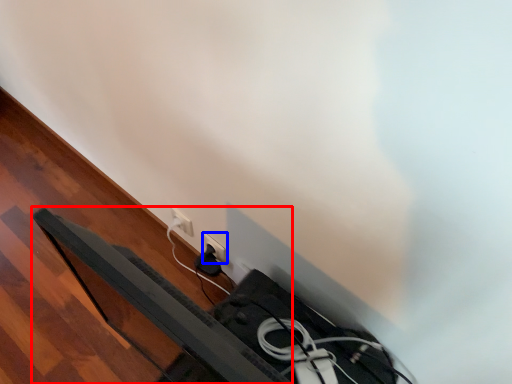
Question: Which object appears farthest to the camera in this image, bed frame (highlighted by a red box) or power plugs and sockets (highlighted by a blue box)?

Choices:
 (A) bed frame
 (B) power plugs and sockets

Answer: (B)